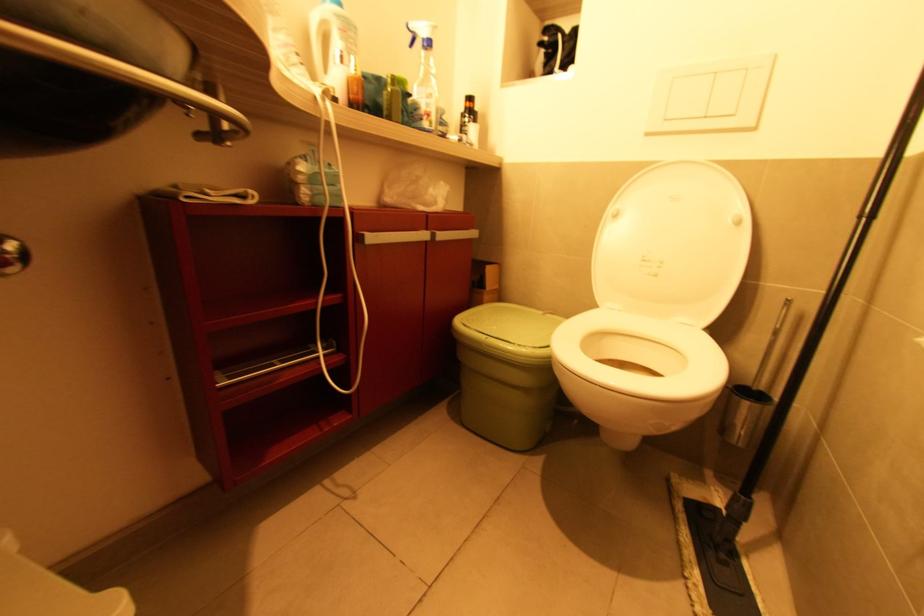
What do you see at coordinates (771, 344) in the screenshot? I see `the toilet brush handle` at bounding box center [771, 344].